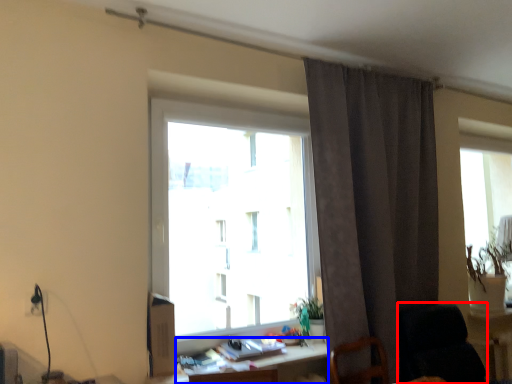
Question: Among these objects, which one is farthest to the camera, rocking chair (highlighted by a red box) or table (highlighted by a blue box)?

Choices:
 (A) rocking chair
 (B) table

Answer: (A)